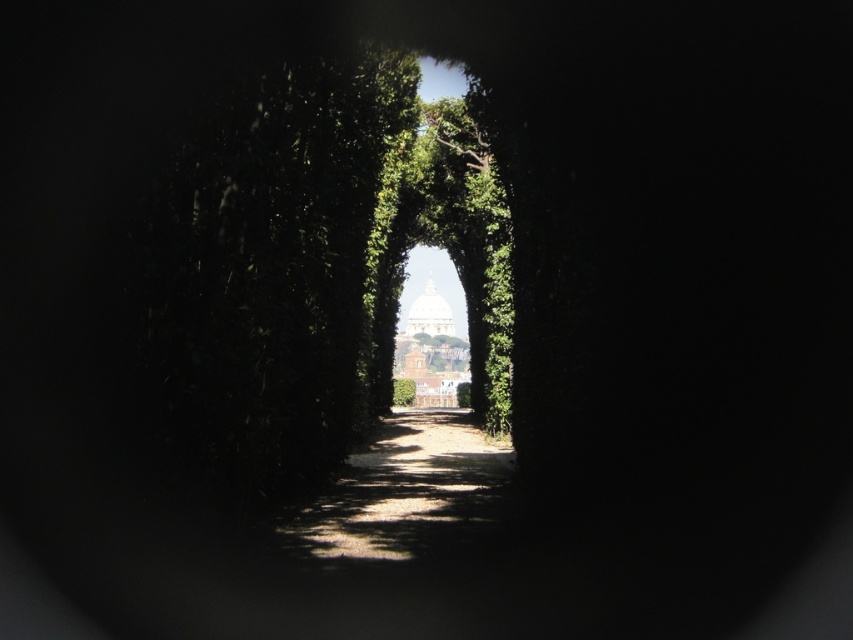
Question: Can you confirm if dirt path at center is positioned to the right of green leafy hedge at center?

Choices:
 (A) yes
 (B) no

Answer: (A)

Question: Is dirt path at center below green leafy hedge at center?

Choices:
 (A) no
 (B) yes

Answer: (B)

Question: Which point is farther to the camera?

Choices:
 (A) dirt path at center
 (B) green leafy hedge at center

Answer: (B)

Question: Can you confirm if dirt path at center is wider than green leafy hedge at center?

Choices:
 (A) no
 (B) yes

Answer: (B)